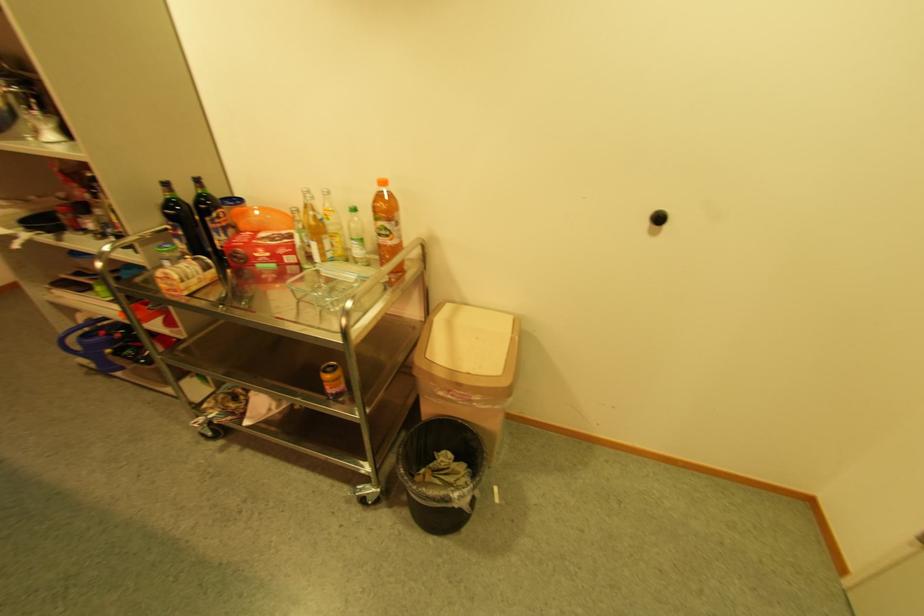
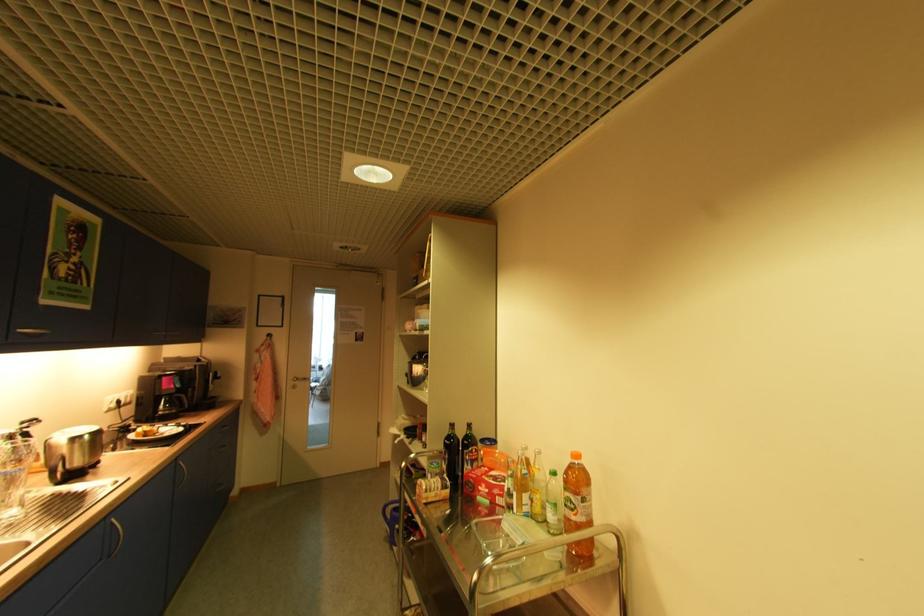
Locate, in the second image, the point that corresponds to pixel 172 217 in the first image.

(451, 445)